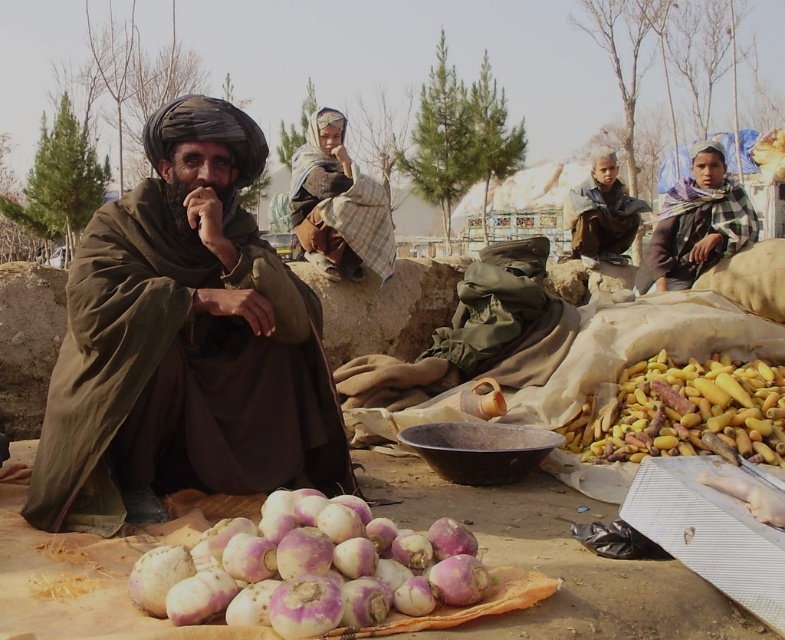
Question: Among these objects, which one is farthest from the camera?

Choices:
 (A) plaid scarf at right
 (B) plaid fabric headscarf at center
 (C) purple-white turnip at lower center
 (D) brown textured blanket at upper right

Answer: (D)

Question: In this image, where is plaid fabric headscarf at center located relative to plaid scarf at right?

Choices:
 (A) above
 (B) below

Answer: (A)

Question: Which object is positioned closest to the purple-white turnip at lower center?

Choices:
 (A) plaid fabric headscarf at center
 (B) brown textured blanket at upper right
 (C) brown woolen robe at center
 (D) yellow matte root vegetables at lower right

Answer: (C)

Question: Can you confirm if purple-white turnip at lower center is positioned to the right of yellow matte root vegetables at lower right?

Choices:
 (A) yes
 (B) no

Answer: (B)

Question: From the image, what is the correct spatial relationship of yellow matte root vegetables at lower right in relation to plaid scarf at right?

Choices:
 (A) right
 (B) left

Answer: (B)

Question: Which object appears farthest from the camera in this image?

Choices:
 (A) yellow matte root vegetables at lower right
 (B) purple-white turnip at lower center
 (C) plaid scarf at right

Answer: (C)